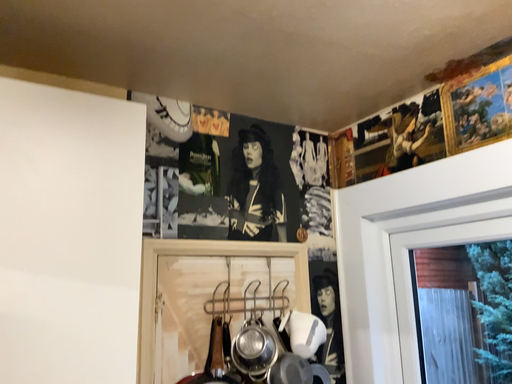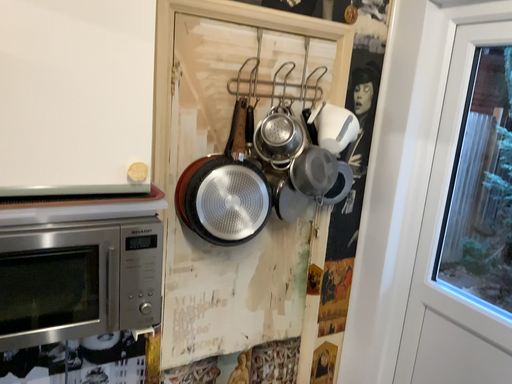
Question: Which way did the camera rotate in the video?

Choices:
 (A) rotated upward
 (B) rotated downward

Answer: (B)